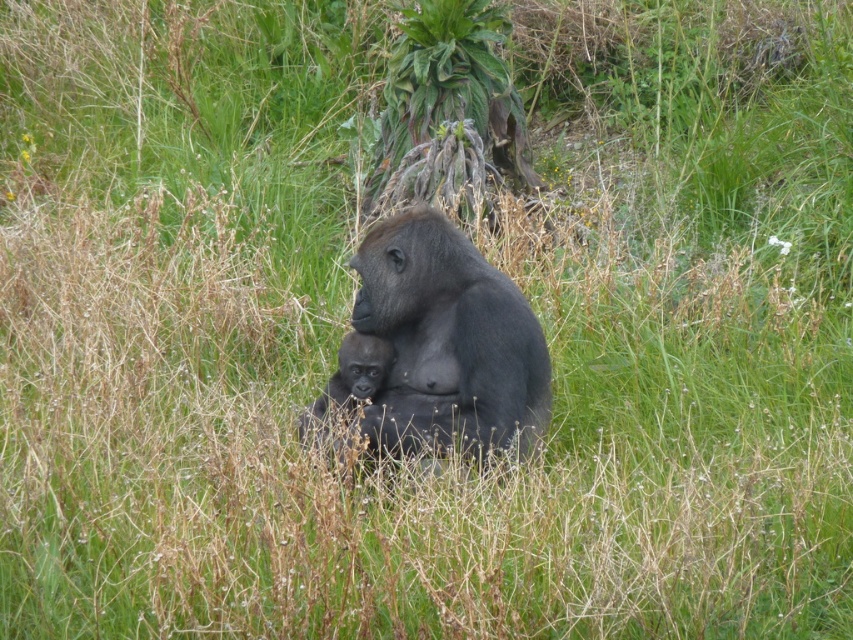
Which is below, shiny dark gray gorilla at center or smooth dark gray baby gorilla at center?

smooth dark gray baby gorilla at center is below.

Can you confirm if shiny dark gray gorilla at center is smaller than smooth dark gray baby gorilla at center?

Incorrect, shiny dark gray gorilla at center is not smaller in size than smooth dark gray baby gorilla at center.

In order to click on shiny dark gray gorilla at center in this screenshot , I will do `click(447, 342)`.